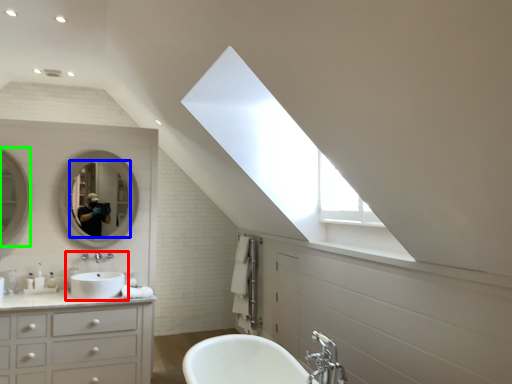
Question: Which is farther away from sink (highlighted by a red box)? mirror (highlighted by a blue box) or mirror (highlighted by a green box)?

Choices:
 (A) mirror
 (B) mirror

Answer: (B)